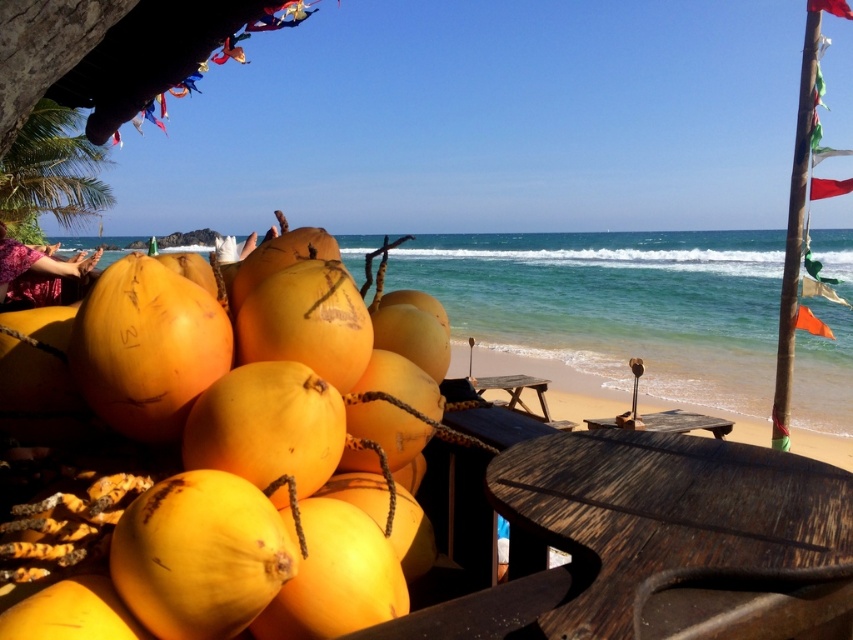
Which is in front, point (810, 276) or point (805, 323)?

Point (805, 323)

Can you confirm if green fabric flag at right is positioned above orange fabric flag at right?

Indeed, green fabric flag at right is positioned over orange fabric flag at right.

What do you see at coordinates (819, 291) in the screenshot? This screenshot has height=640, width=853. I see `green fabric flag at right` at bounding box center [819, 291].

At what (x,y) coordinates should I click in order to perform the action: click on green fabric flag at right. Please return your answer as a coordinate pair (x, y). Looking at the image, I should click on (819, 291).

Who is higher up, yellow matte coconuts at center or red fabric flag at upper right?

red fabric flag at upper right

This screenshot has width=853, height=640. Identify the location of yellow matte coconuts at center. (224, 451).

Is point (338, 417) closer to viewer compared to point (828, 1)?

That is True.

The height and width of the screenshot is (640, 853). Identify the location of yellow matte coconuts at center. click(x=224, y=451).

In the scene shown: Can you confirm if green fabric flag at right is positioned to the right of red fabric flag at upper right?

Yes, green fabric flag at right is to the right of red fabric flag at upper right.

Consider the image. Which is more to the left, green fabric flag at right or red fabric flag at upper right?

From the viewer's perspective, red fabric flag at upper right appears more on the left side.

Is point (804, 275) positioned after point (809, 4)?

Yes, it is behind point (809, 4).

Where is `green fabric flag at right`? The width and height of the screenshot is (853, 640). green fabric flag at right is located at coordinates (819, 291).